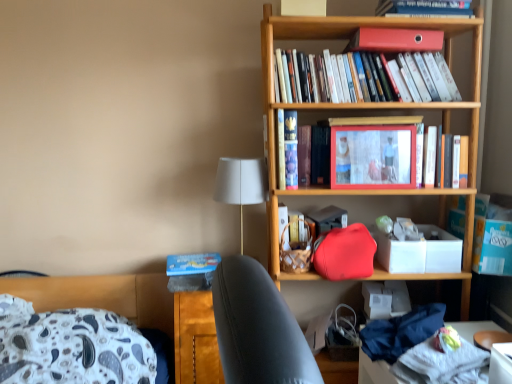
Question: Considering the relative sizes of white fabric lampshade at center and matte plastic picture frame at center in the image provided, is white fabric lampshade at center bigger than matte plastic picture frame at center?

Choices:
 (A) no
 (B) yes

Answer: (B)

Question: Is white fabric lampshade at center outside matte plastic picture frame at center?

Choices:
 (A) no
 (B) yes

Answer: (B)

Question: Is white fabric lampshade at center thinner than matte plastic picture frame at center?

Choices:
 (A) no
 (B) yes

Answer: (A)

Question: Is white fabric lampshade at center directly adjacent to matte plastic picture frame at center?

Choices:
 (A) no
 (B) yes

Answer: (A)

Question: From the image's perspective, is white fabric lampshade at center on matte plastic picture frame at center?

Choices:
 (A) yes
 (B) no

Answer: (B)

Question: Is white fabric lampshade at center closer to the viewer compared to matte plastic picture frame at center?

Choices:
 (A) no
 (B) yes

Answer: (B)

Question: Considering the relative sizes of hardcover books at upper center, marked as the third book in a bottom-to-top arrangement, and hardcover book at center, which ranks as the second book in top-to-bottom order, in the image provided, is hardcover books at upper center, marked as the third book in a bottom-to-top arrangement, taller than hardcover book at center, which ranks as the second book in top-to-bottom order,?

Choices:
 (A) yes
 (B) no

Answer: (B)

Question: Is hardcover books at upper center, marked as the third book in a bottom-to-top arrangement, behind hardcover book at center, which is counted as the 2th book, starting from the bottom?

Choices:
 (A) no
 (B) yes

Answer: (A)

Question: From the image's perspective, does hardcover books at upper center, which is counted as the 1th book, starting from the top, appear lower than hardcover book at center, which ranks as the second book in top-to-bottom order?

Choices:
 (A) yes
 (B) no

Answer: (B)

Question: Can hardcover book at center, which is counted as the 2th book, starting from the bottom, be found inside hardcover books at upper center, which is counted as the 1th book, starting from the top?

Choices:
 (A) yes
 (B) no

Answer: (B)

Question: Considering the relative sizes of hardcover books at upper center, marked as the third book in a bottom-to-top arrangement, and hardcover book at center, which ranks as the second book in top-to-bottom order, in the image provided, is hardcover books at upper center, marked as the third book in a bottom-to-top arrangement, bigger than hardcover book at center, which ranks as the second book in top-to-bottom order,?

Choices:
 (A) no
 (B) yes

Answer: (B)

Question: Considering the relative sizes of hardcover books at upper center, marked as the third book in a bottom-to-top arrangement, and hardcover book at center, which ranks as the second book in top-to-bottom order, in the image provided, is hardcover books at upper center, marked as the third book in a bottom-to-top arrangement, wider than hardcover book at center, which ranks as the second book in top-to-bottom order,?

Choices:
 (A) yes
 (B) no

Answer: (A)

Question: Is white matte box at center-right oriented away from matte plastic picture frame at center?

Choices:
 (A) no
 (B) yes

Answer: (A)